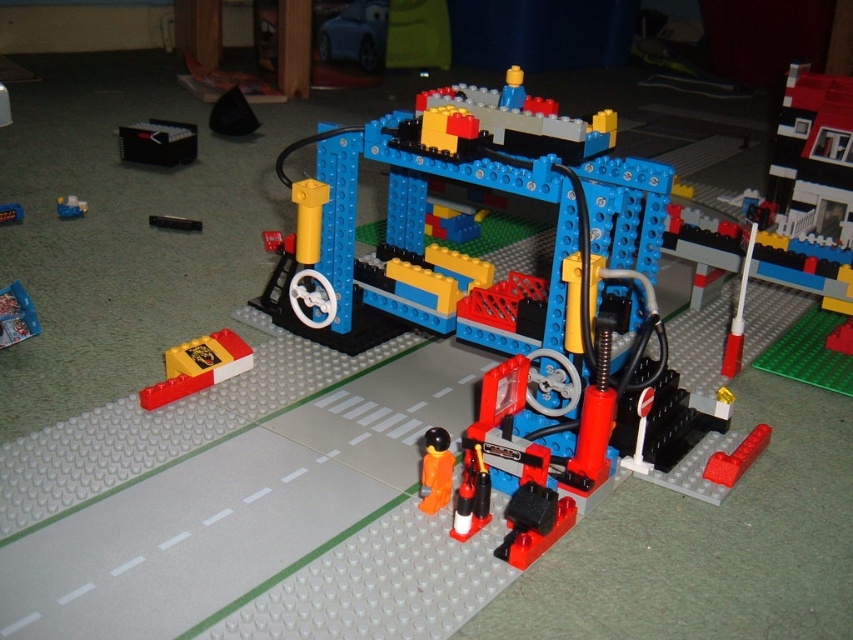
What is the width comparison between the black plastic remote control at upper left and the blue plastic toy at center?

The black plastic remote control at upper left might be wider than blue plastic toy at center.

You are a parent checking the safety of toys for your child. You see an orange matte figure at center and a blue plastic toy at center in the LEGO set. Which one is taller and could potentially pose a choking hazard if swallowed?

The orange matte figure at center is taller than the blue plastic toy at center, so the orange matte figure at center is taller and could potentially pose a choking hazard if swallowed.